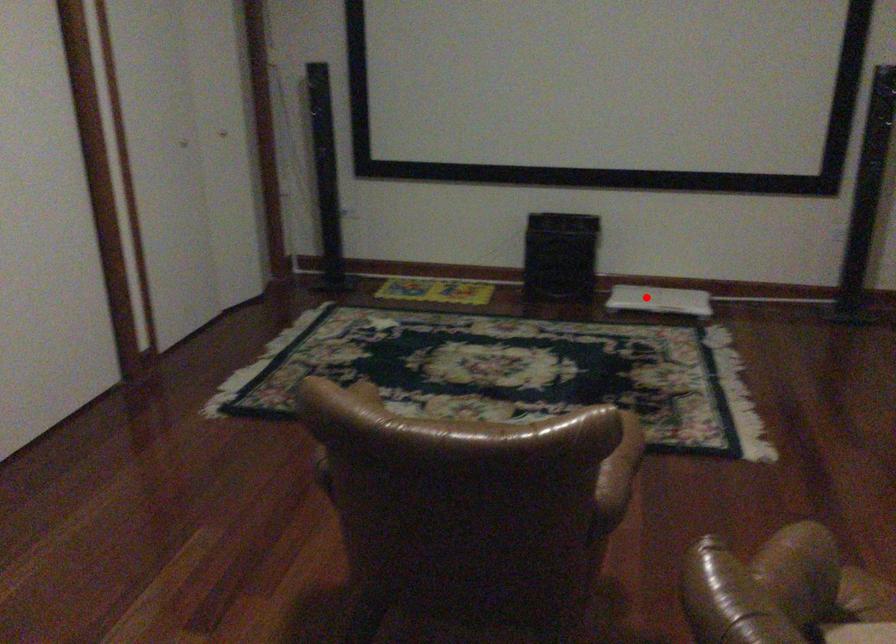
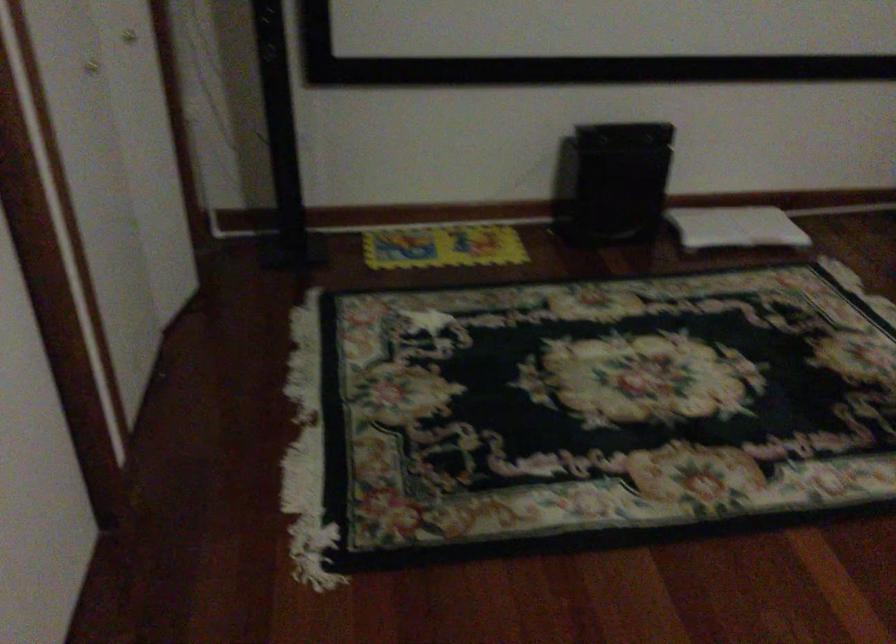
Question: I am providing you with two images of the same scene from different viewpoints. In image1, a red point is highlighted. Considering the same 3D point in image2, which of the following is correct?

Choices:
 (A) It is closer
 (B) It is farther

Answer: (A)